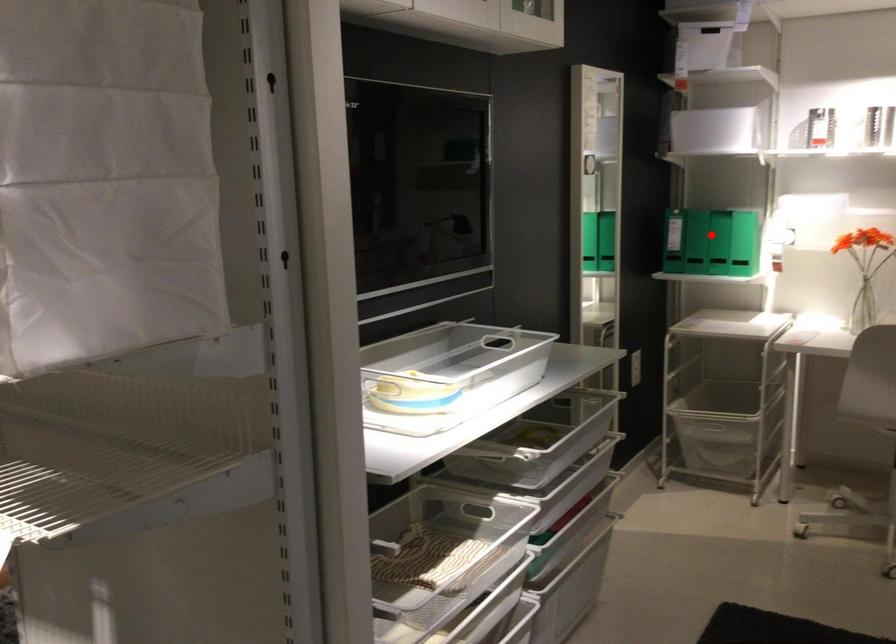
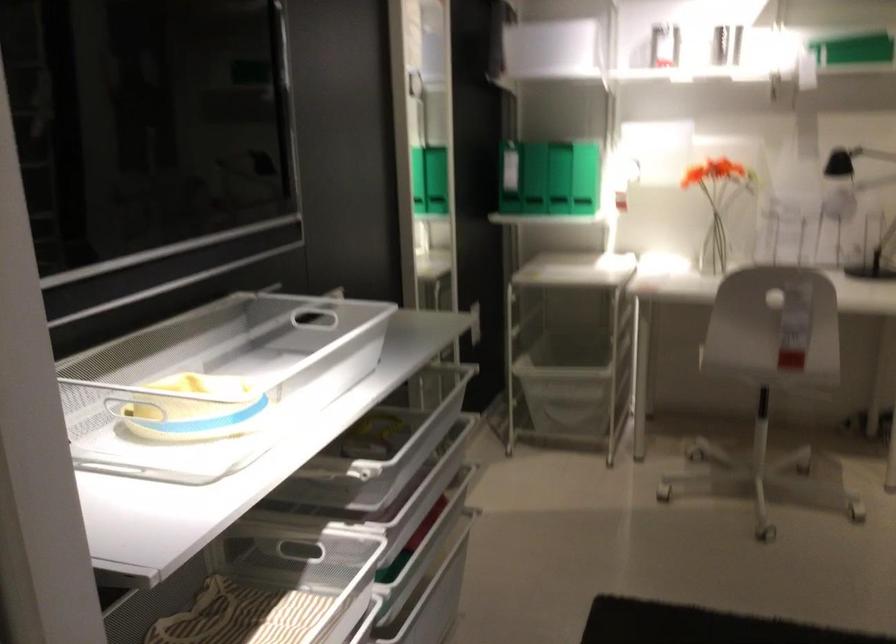
Question: A red point is marked in image1. In image2, is the corresponding 3D point closer to the camera or farther? Reply with the corresponding letter.

Choices:
 (A) The corresponding 3D point is closer.
 (B) The corresponding 3D point is farther.

Answer: (A)